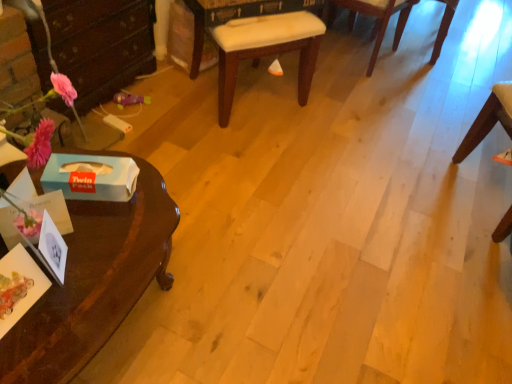
At what (x,y) coordinates should I click in order to perform the action: click on vacant space to the right of glossy dark wood desk at left. Please return your answer as a coordinate pair (x, y). Looking at the image, I should click on (247, 297).